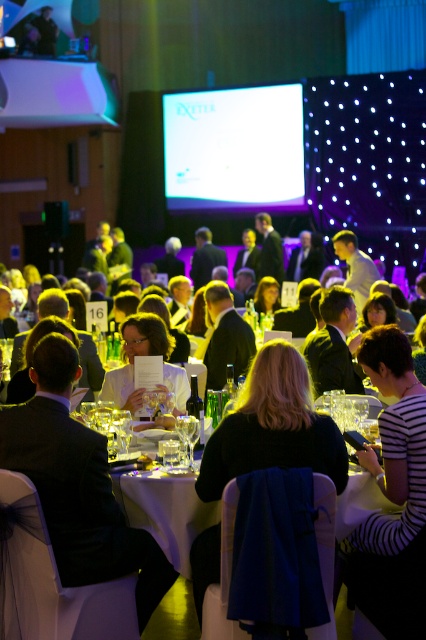
You are a photographer at the event and want to capture a photo of the white fabric chair at center and the white glossy shirt at center. Since both are white, you need to adjust your camera settings to ensure proper exposure. Which object should you focus on first to get the best exposure for both?

The white fabric chair at center is below the white glossy shirt at center. Focus on the white glossy shirt at center first because it is higher up and might reflect more light, ensuring better exposure for both objects.

You are a server at the event and need to place a 20 inch wide tray between the white fabric chair at center and the black matte jacket at center. Can you fit the tray there?

The distance between the white fabric chair at center and the black matte jacket at center is 23.27 inches. Since the tray is 20 inches wide, it can fit as there is enough space.

You are a photographer at the event and need to capture a closeup of the black matte jacket at center without the white fabric chair at center blocking the view. Can you move the chair to the side?

The white fabric chair at center is wider than the black matte jacket at center, so moving the chair might be necessary to avoid blocking the jacket in your photo.